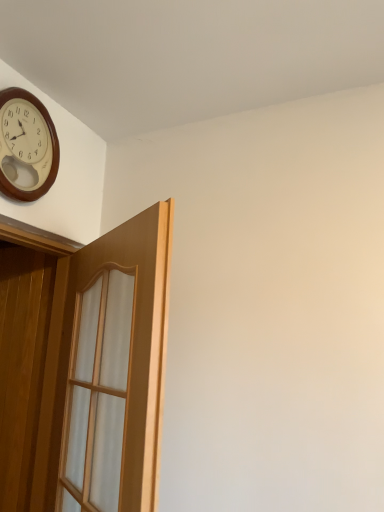
Where is `light brown wood door at upper left`? This screenshot has height=512, width=384. light brown wood door at upper left is located at coordinates (106, 371).

Image resolution: width=384 pixels, height=512 pixels. Describe the element at coordinates (106, 371) in the screenshot. I see `light brown wood door at upper left` at that location.

Describe the element at coordinates (26, 146) in the screenshot. This screenshot has width=384, height=512. I see `wooden clock at upper left` at that location.

Where is `wooden clock at upper left`? The width and height of the screenshot is (384, 512). wooden clock at upper left is located at coordinates 26,146.

The height and width of the screenshot is (512, 384). What are the coordinates of `light brown wood door at upper left` in the screenshot? It's located at (106, 371).

Would you say wooden clock at upper left is to the left or to the right of light brown wood door at upper left in the picture?

From the image, it's evident that wooden clock at upper left is to the left of light brown wood door at upper left.

Consider the image. Considering the positions of objects wooden clock at upper left and light brown wood door at upper left in the image provided, who is in front, wooden clock at upper left or light brown wood door at upper left?

light brown wood door at upper left.

Considering the positions of points (28, 196) and (133, 396), is point (28, 196) closer to camera compared to point (133, 396)?

No, it is not.

From the image's perspective, relative to light brown wood door at upper left, is wooden clock at upper left above or below?

wooden clock at upper left is above light brown wood door at upper left.

From a real-world perspective, is wooden clock at upper left above or below light brown wood door at upper left?

Clearly, from a real-world perspective, wooden clock at upper left is above light brown wood door at upper left.

Which object is wider, wooden clock at upper left or light brown wood door at upper left?

Wider between the two is light brown wood door at upper left.

Is wooden clock at upper left taller or shorter than light brown wood door at upper left?

Considering their sizes, wooden clock at upper left has less height than light brown wood door at upper left.

Based on the photo, looking at the image, does wooden clock at upper left seem bigger or smaller compared to light brown wood door at upper left?

In the image, wooden clock at upper left appears to be smaller than light brown wood door at upper left.

Would you say wooden clock at upper left is inside or outside light brown wood door at upper left?

wooden clock at upper left is not enclosed by light brown wood door at upper left.

Is wooden clock at upper left in contact with light brown wood door at upper left?

No, wooden clock at upper left is not in contact with light brown wood door at upper left.

Is wooden clock at upper left oriented towards light brown wood door at upper left?

No, wooden clock at upper left is not facing towards light brown wood door at upper left.

How different are the orientations of wooden clock at upper left and light brown wood door at upper left in degrees?

wooden clock at upper left and light brown wood door at upper left are facing 127 degrees away from each other.

How much distance is there between wooden clock at upper left and light brown wood door at upper left?

A distance of 58.35 centimeters exists between wooden clock at upper left and light brown wood door at upper left.

Where is `clock behind the light brown wood door at upper left`? Image resolution: width=384 pixels, height=512 pixels. clock behind the light brown wood door at upper left is located at coordinates (26, 146).

Based on their positions, is light brown wood door at upper left located to the left or right of wooden clock at upper left?

From the image, it's evident that light brown wood door at upper left is to the right of wooden clock at upper left.

Is the depth of light brown wood door at upper left less than that of wooden clock at upper left?

Yes, the depth of light brown wood door at upper left is less than that of wooden clock at upper left.

Is point (146, 495) closer to camera compared to point (34, 147)?

Yes.

Based on the photo, from the image's perspective, is light brown wood door at upper left located above or below wooden clock at upper left?

Clearly, from the image's perspective, light brown wood door at upper left is below wooden clock at upper left.

From the picture: From a real-world perspective, relative to wooden clock at upper left, is light brown wood door at upper left vertically above or below?

In terms of real-world spatial position, light brown wood door at upper left is below wooden clock at upper left.

Can you confirm if light brown wood door at upper left is thinner than wooden clock at upper left?

No, light brown wood door at upper left is not thinner than wooden clock at upper left.

Does light brown wood door at upper left have a greater height compared to wooden clock at upper left?

Yes, light brown wood door at upper left is taller than wooden clock at upper left.

Considering the sizes of light brown wood door at upper left and wooden clock at upper left in the image, is light brown wood door at upper left bigger or smaller than wooden clock at upper left?

In the image, light brown wood door at upper left appears to be larger than wooden clock at upper left.

Is light brown wood door at upper left situated inside wooden clock at upper left or outside?

light brown wood door at upper left exists outside the volume of wooden clock at upper left.

Is light brown wood door at upper left far away from wooden clock at upper left?

That's not correct — light brown wood door at upper left is a little close to wooden clock at upper left.

Is light brown wood door at upper left looking in the opposite direction of wooden clock at upper left?

No.

In the scene shown: How different are the orientations of light brown wood door at upper left and wooden clock at upper left in degrees?

The facing directions of light brown wood door at upper left and wooden clock at upper left are 127 degrees apart.

The image size is (384, 512). Identify the location of clock above the light brown wood door at upper left (from a real-world perspective). (26, 146).

Identify the location of door beneath the wooden clock at upper left (from a real-world perspective). (106, 371).

There is a light brown wood door at upper left. Identify the location of clock above it (from a real-world perspective). (26, 146).